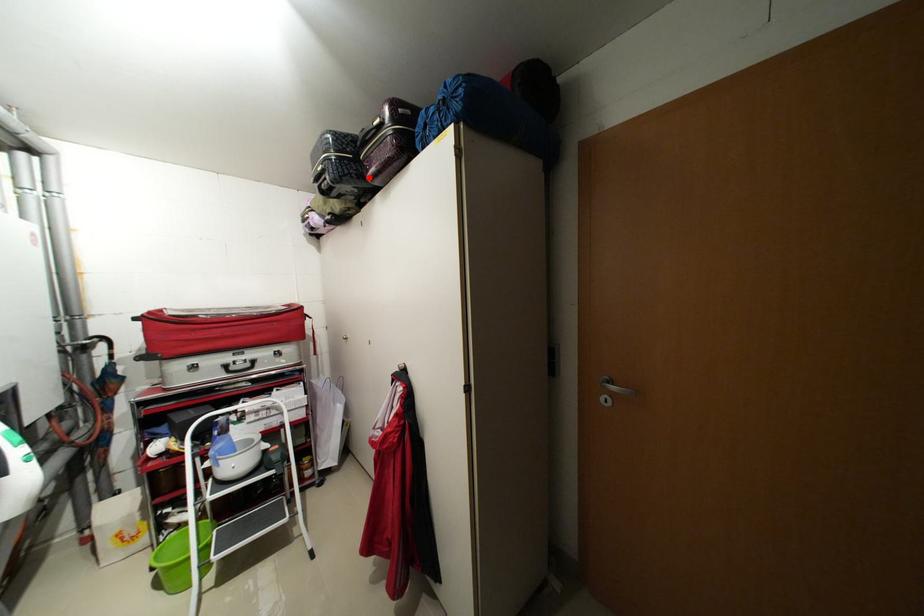
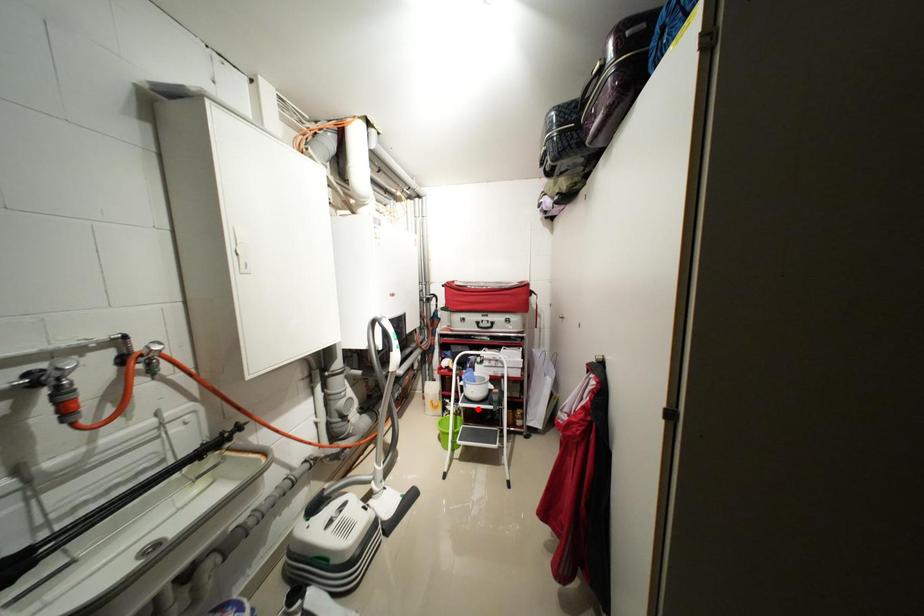
I am providing you with two images of the same scene from different viewpoints. A red point is marked on the first image and another point is marked on the second image. Are the points marked in image1 and image2 representing the same 3D position?

No